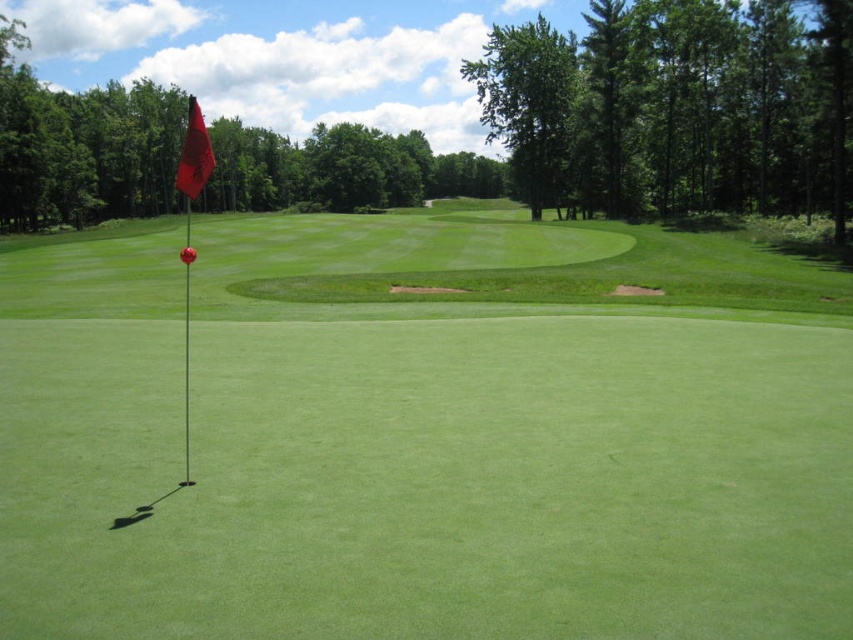
Question: Is red flag at center wider than red fabric flag at upper left?

Choices:
 (A) no
 (B) yes

Answer: (B)

Question: Does red flag at center have a smaller size compared to red fabric flag at upper left?

Choices:
 (A) yes
 (B) no

Answer: (A)

Question: Which object is closer to the camera taking this photo?

Choices:
 (A) red flag at center
 (B) red fabric flag at upper left

Answer: (A)

Question: Is red flag at center wider than red fabric flag at upper left?

Choices:
 (A) no
 (B) yes

Answer: (B)